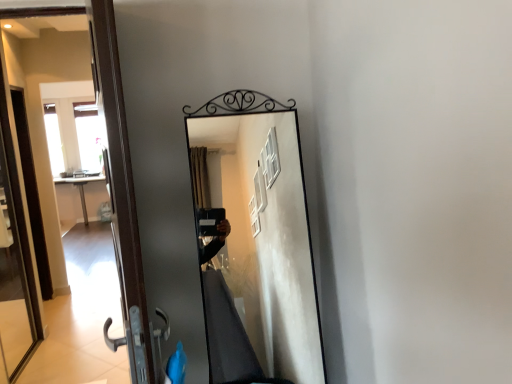
Where is `matte black door at left`? Image resolution: width=512 pixels, height=384 pixels. matte black door at left is located at coordinates (71, 105).

The width and height of the screenshot is (512, 384). Describe the element at coordinates (71, 105) in the screenshot. I see `matte black door at left` at that location.

This screenshot has height=384, width=512. In order to click on matte black door at left in this screenshot , I will do `click(71, 105)`.